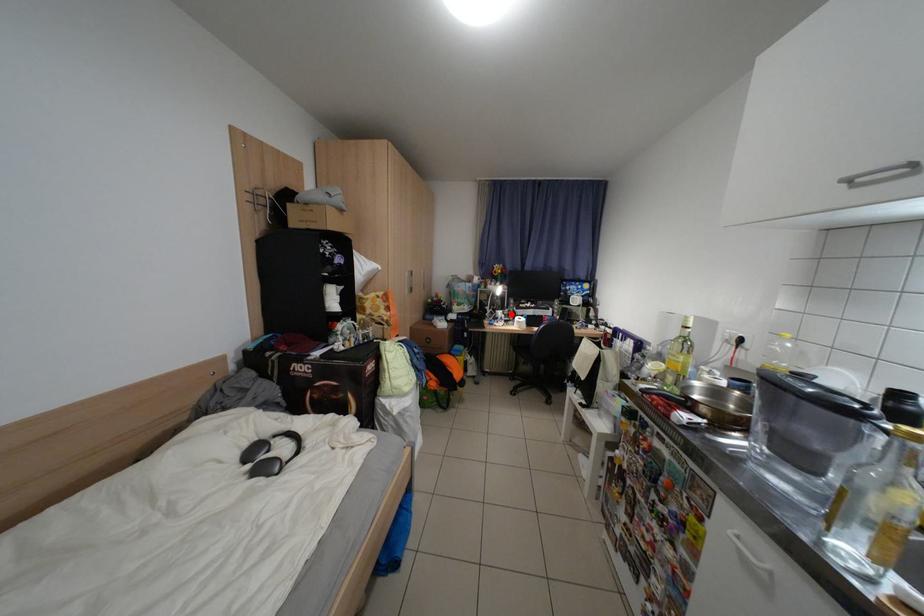
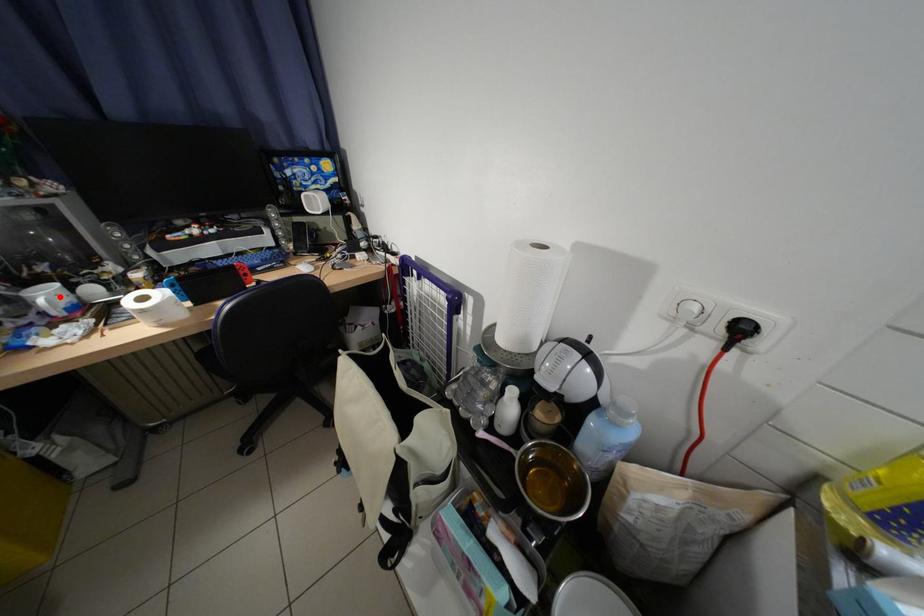
I am providing you with two images of the same scene from different viewpoints. A red point is marked on the first image and another point is marked on the second image. Is the marked point in image1 the same physical position as the marked point in image2?

Yes